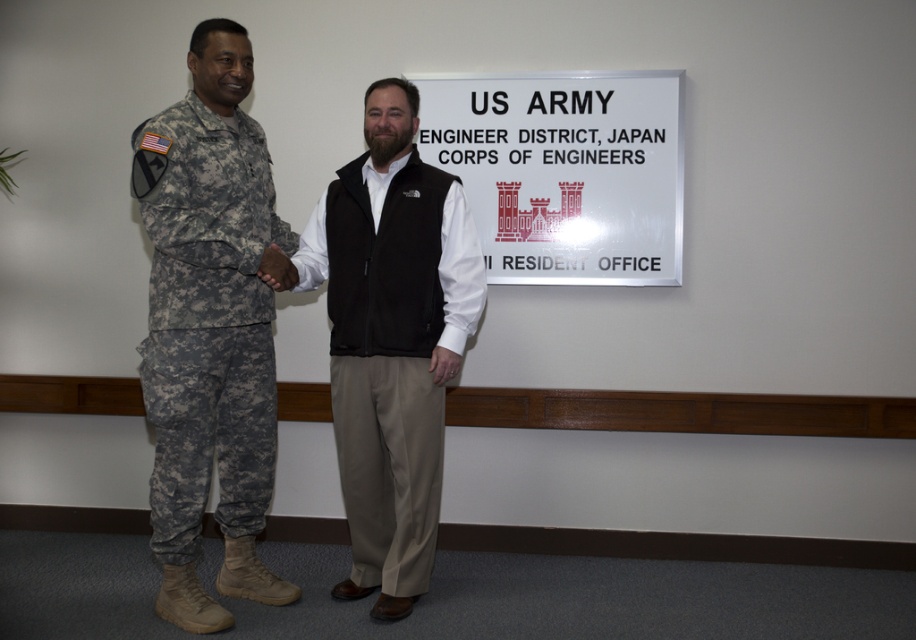
Question: Which point is closer to the camera taking this photo?

Choices:
 (A) (341, 228)
 (B) (199, 106)

Answer: (B)

Question: Does black fleece vest at center appear on the right side of camouflage fabric uniform at left?

Choices:
 (A) no
 (B) yes

Answer: (B)

Question: Which object is farther from the camera taking this photo?

Choices:
 (A) camouflage fabric uniform at left
 (B) black fleece vest at center

Answer: (B)

Question: Does black fleece vest at center lie in front of camouflage fabric uniform at left?

Choices:
 (A) yes
 (B) no

Answer: (B)

Question: Does black fleece vest at center have a larger size compared to camouflage fabric uniform at left?

Choices:
 (A) yes
 (B) no

Answer: (A)